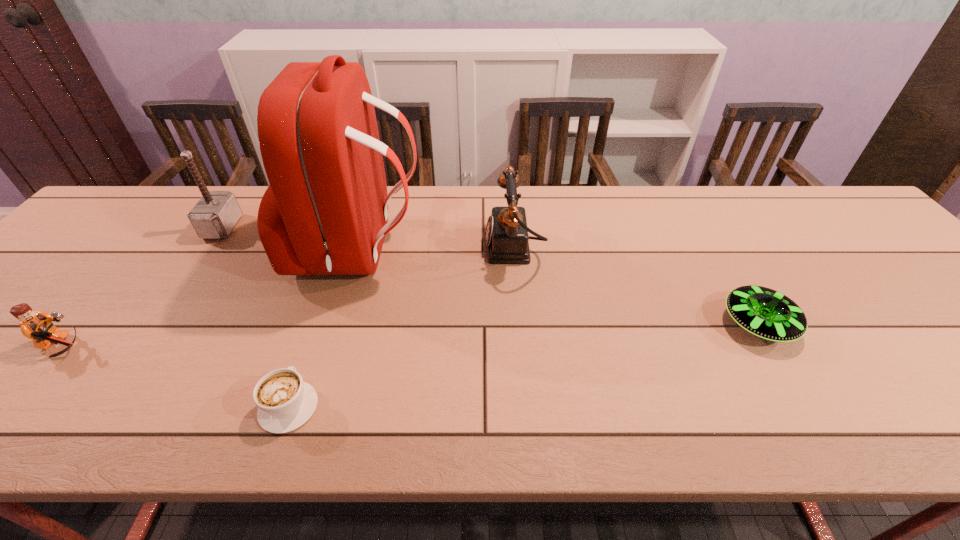
Locate an element on the screen. The image size is (960, 540). the tallest object is located at coordinates (325, 212).

I want to click on the second object from left to right, so click(x=214, y=216).

Image resolution: width=960 pixels, height=540 pixels. I want to click on the fifth shortest object, so click(x=214, y=216).

The image size is (960, 540). I want to click on telephone, so click(506, 237).

Locate an element on the screen. the second object from right to left is located at coordinates (506, 237).

Identify the location of the fourth tallest object. (38, 326).

Find the location of a particular element. Lego is located at coordinates click(38, 326).

At what (x,y) coordinates should I click in order to perform the action: click on the rightmost object. Please return your answer as a coordinate pair (x, y). Looking at the image, I should click on 765,313.

I want to click on cappuccino, so click(285, 402).

Locate an element on the screen. The height and width of the screenshot is (540, 960). the nearest object is located at coordinates (285, 402).